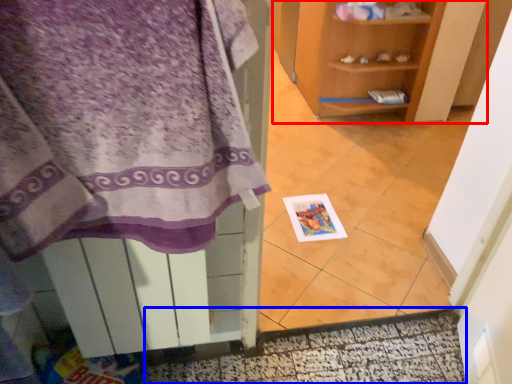
Question: Which object is closer to the camera taking this photo, shelf (highlighted by a red box) or door (highlighted by a blue box)?

Choices:
 (A) shelf
 (B) door

Answer: (B)